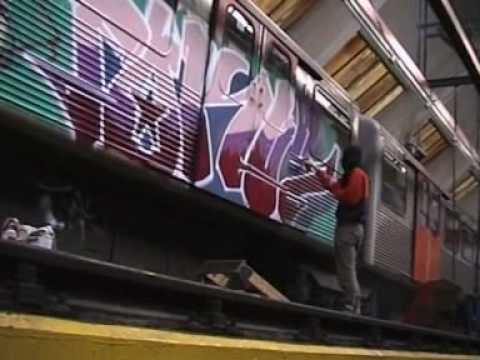
Locate an element on the screen. blue paint is located at coordinates (109, 67).